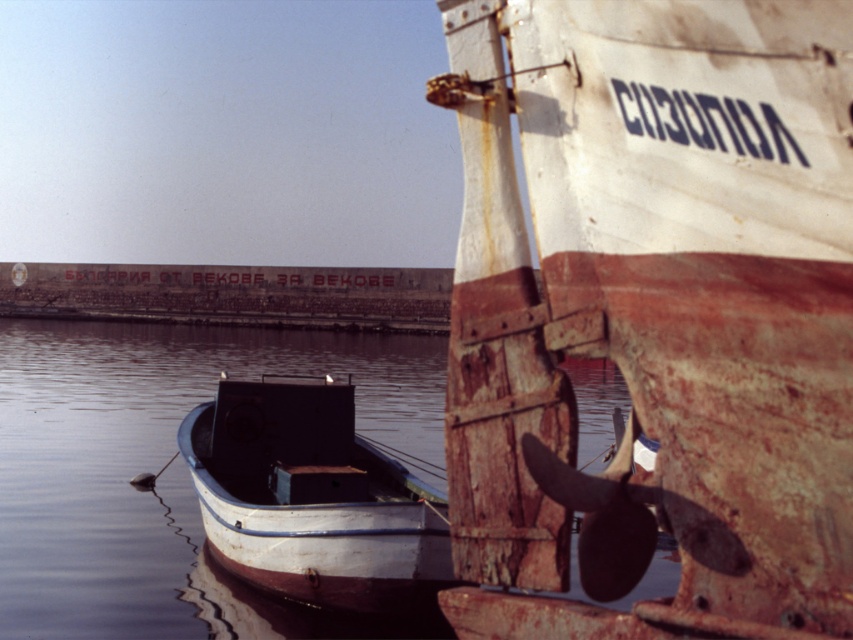
In the scene shown: You are standing at the point marked as point (654, 310). Which boat is directly in front of you?

The rusty wood boat at center is located at point (654, 310), so it is directly in front of you.

In the scene shown: You are a photographer planning to capture the waterfront scene. You want to ensure that both the smooth water at center and the rusty metal boat at center are clearly visible in your shot. Based on their relative sizes in the image, which object should you focus on first to frame the composition effectively?

The smooth water at center is much taller than the rusty metal boat at center, so you should focus on the smooth water at center first to ensure it occupies the majority of the frame while still including the rusty metal boat at center in the composition.

You are a sailor planning to navigate a small boat through the water between the smooth water at center and the rusty metal boat at center. Based on the scene, can you determine if there is enough space for your boat to pass safely?

The smooth water at center might be wider than rusty metal boat at center, so there is a possibility that the space between them is sufficient for your boat to pass safely.